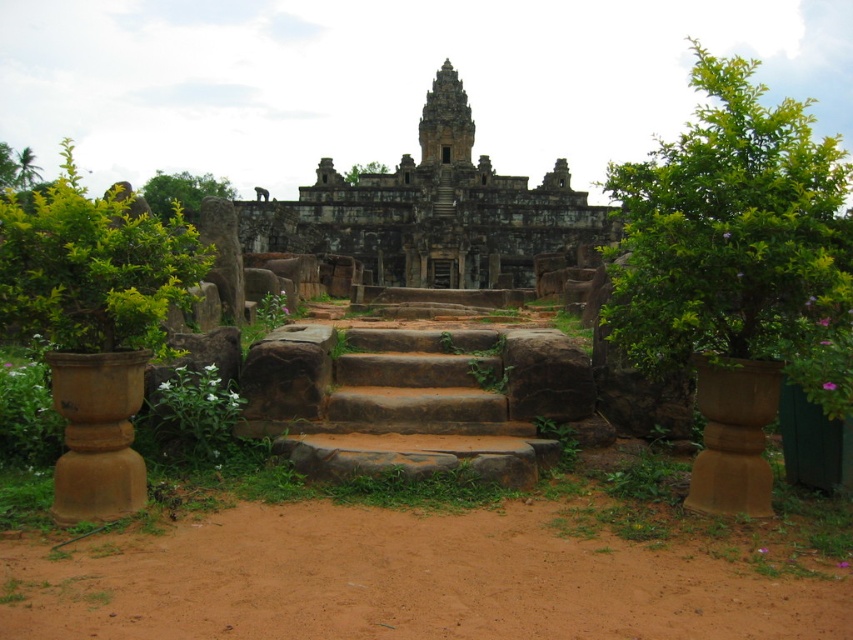
Question: Considering the relative positions of green leafy bush at left and green leafy tree at upper center in the image provided, where is green leafy bush at left located with respect to green leafy tree at upper center?

Choices:
 (A) right
 (B) left

Answer: (B)

Question: Among these points, which one is nearest to the camera?

Choices:
 (A) (221, 195)
 (B) (0, 163)
 (C) (461, 252)
 (D) (675, 230)

Answer: (D)

Question: Based on their relative distances, which object is nearer to the brown stone stairs at center?

Choices:
 (A) green leafy tree at center
 (B) green leafy tree at upper right
 (C) green leafy bush at left

Answer: (C)

Question: Which of the following is the farthest from the observer?

Choices:
 (A) (68, 620)
 (B) (691, 209)

Answer: (B)

Question: Where is green leafy tree at upper right located in relation to green leafy bush at left in the image?

Choices:
 (A) left
 (B) right

Answer: (B)

Question: Does brown stone stairs at center have a lesser width compared to green leafy tree at upper center?

Choices:
 (A) yes
 (B) no

Answer: (A)